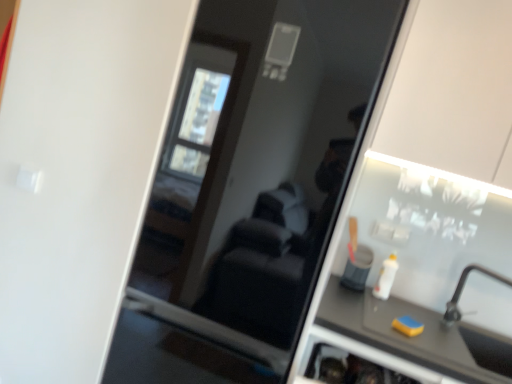
Question: From a real-world perspective, is matte black counter top at lower right positioned under silver metallic faucet at lower right based on gravity?

Choices:
 (A) no
 (B) yes

Answer: (B)

Question: Is matte black counter top at lower right directly adjacent to silver metallic faucet at lower right?

Choices:
 (A) no
 (B) yes

Answer: (A)

Question: From a real-world perspective, does matte black counter top at lower right stand above silver metallic faucet at lower right?

Choices:
 (A) yes
 (B) no

Answer: (B)

Question: Considering the relative positions of matte black counter top at lower right and silver metallic faucet at lower right in the image provided, is matte black counter top at lower right to the right of silver metallic faucet at lower right from the viewer's perspective?

Choices:
 (A) yes
 (B) no

Answer: (B)

Question: Considering the relative sizes of matte black counter top at lower right and silver metallic faucet at lower right in the image provided, is matte black counter top at lower right thinner than silver metallic faucet at lower right?

Choices:
 (A) no
 (B) yes

Answer: (A)

Question: Is matte black counter top at lower right far from silver metallic faucet at lower right?

Choices:
 (A) no
 (B) yes

Answer: (A)

Question: Is yellow sponge at lower right at the left side of matte black counter top at lower right?

Choices:
 (A) no
 (B) yes

Answer: (B)

Question: Is yellow sponge at lower right in front of matte black counter top at lower right?

Choices:
 (A) no
 (B) yes

Answer: (A)

Question: Can you confirm if yellow sponge at lower right is shorter than matte black counter top at lower right?

Choices:
 (A) yes
 (B) no

Answer: (A)

Question: Is yellow sponge at lower right turned away from matte black counter top at lower right?

Choices:
 (A) no
 (B) yes

Answer: (A)

Question: From the image's perspective, would you say yellow sponge at lower right is shown under matte black counter top at lower right?

Choices:
 (A) yes
 (B) no

Answer: (B)

Question: Could matte black counter top at lower right be considered to be inside yellow sponge at lower right?

Choices:
 (A) no
 (B) yes

Answer: (A)

Question: Is white plastic bottle at right at the left side of silver metallic faucet at lower right?

Choices:
 (A) no
 (B) yes

Answer: (B)